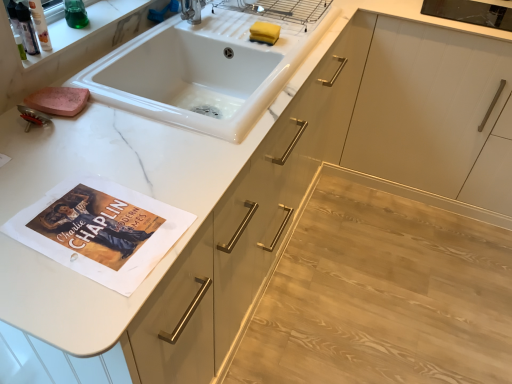
The image size is (512, 384). Identify the location of vacant space in front of yellow sponge at sink. (275, 52).